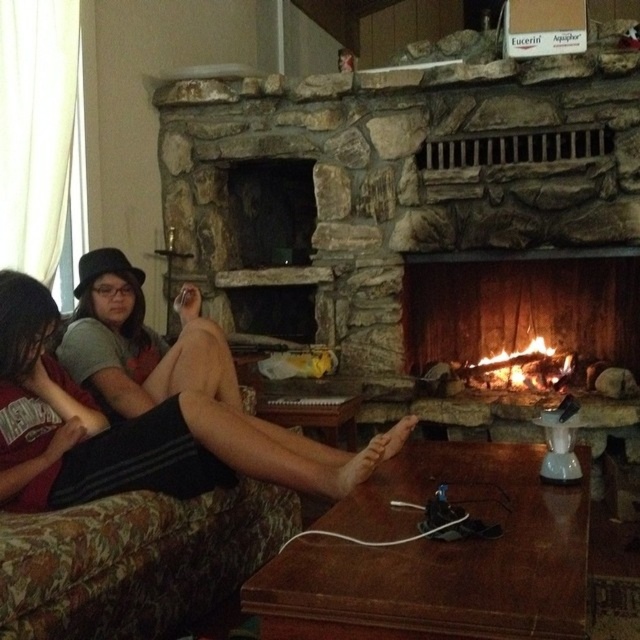
Is point (433, 268) more distant than point (221, 342)?

Yes, it is.

Measure the distance between wooden logs burning at center and camera.

The distance of wooden logs burning at center from camera is 10.86 feet.

Image resolution: width=640 pixels, height=640 pixels. I want to click on wooden logs burning at center, so click(x=522, y=307).

Is matte black hat at upper left below charcoal wood fire at center?

Incorrect, matte black hat at upper left is not positioned below charcoal wood fire at center.

Is matte black hat at upper left above charcoal wood fire at center?

Indeed, matte black hat at upper left is positioned over charcoal wood fire at center.

Who is more distant from viewer, (77, 300) or (516, 384)?

Point (516, 384)

This screenshot has height=640, width=640. Identify the location of matte black hat at upper left. (140, 342).

Does point (378, 456) lie in front of point (499, 330)?

Yes, it is.

Is point (209, 394) positioned before point (436, 292)?

Yes.

In order to click on matte black shorts at center in this screenshot , I will do `click(145, 420)`.